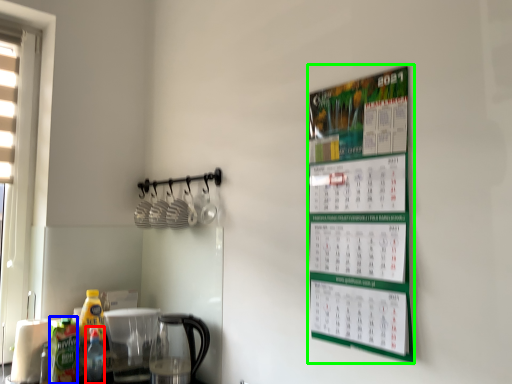
Question: Considering the real-world distances, which object is farthest from bottle (highlighted by a red box)? bottle (highlighted by a blue box) or bulletin board (highlighted by a green box)?

Choices:
 (A) bottle
 (B) bulletin board

Answer: (B)